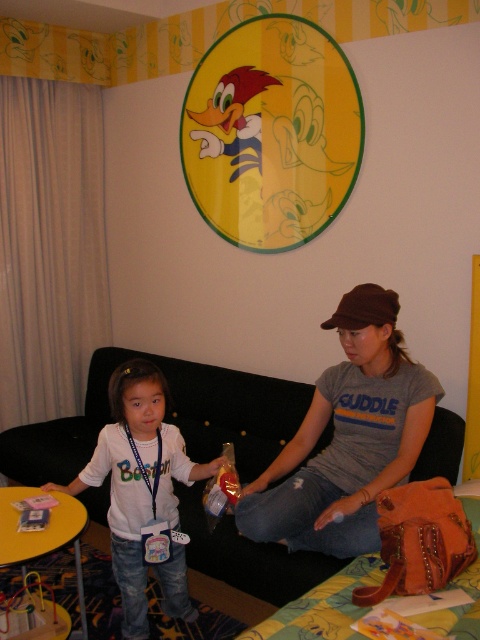
Question: Does black fabric couch at center have a greater width compared to white matte shirt at center?

Choices:
 (A) yes
 (B) no

Answer: (A)

Question: Which point is closer to the camera?

Choices:
 (A) (168, 484)
 (B) (319, 481)

Answer: (B)

Question: Does black fabric couch at center have a lesser width compared to brown fabric baseball cap at center?

Choices:
 (A) yes
 (B) no

Answer: (B)

Question: Which point appears farthest from the camera in this image?

Choices:
 (A) (382, 392)
 (B) (343, 323)
 (C) (167, 483)

Answer: (C)

Question: Is black fabric couch at center to the right of white matte shirt at center from the viewer's perspective?

Choices:
 (A) no
 (B) yes

Answer: (B)

Question: Considering the real-world distances, which object is closest to the black fabric couch at center?

Choices:
 (A) white matte shirt at center
 (B) brown fabric baseball cap at center

Answer: (A)